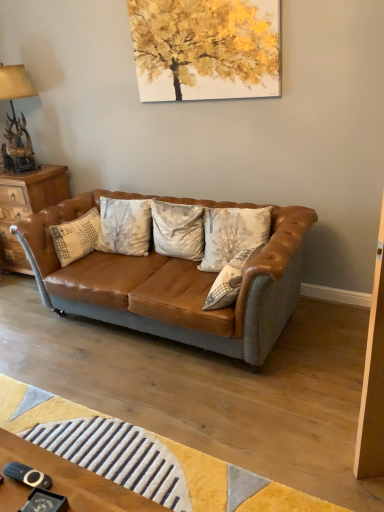
I want to click on white textured pillow at center, the first pillow when ordered from left to right, so click(x=77, y=237).

The width and height of the screenshot is (384, 512). I want to click on yellow woolen mat at lower center, so click(x=143, y=456).

Where is `silky beige pillow at center, the third pillow when ordered from right to left`? The height and width of the screenshot is (512, 384). silky beige pillow at center, the third pillow when ordered from right to left is located at coordinates (178, 230).

Describe the element at coordinates (178, 230) in the screenshot. The image size is (384, 512). I see `silky beige pillow at center, positioned as the 2th pillow in left-to-right order` at that location.

What do you see at coordinates (232, 234) in the screenshot? I see `textured beige pillow at center, marked as the 4th pillow in a left-to-right arrangement` at bounding box center [232, 234].

I want to click on antler bronze lamp at upper left, so click(16, 119).

The width and height of the screenshot is (384, 512). What do you see at coordinates (229, 281) in the screenshot?
I see `textured beige pillow at center, which is counted as the third pillow, starting from the left` at bounding box center [229, 281].

Identify the location of white textured pillow at center, the first pillow when ordered from left to right. (77, 237).

From a real-world perspective, is yellow woolen mat at lower center on top of white textured pillow at center, the first pillow when ordered from left to right?

Incorrect, from a real-world perspective, yellow woolen mat at lower center is lower than white textured pillow at center, the first pillow when ordered from left to right.

Is yellow woolen mat at lower center oriented away from white textured pillow at center, the first pillow when ordered from left to right?

No, yellow woolen mat at lower center is not facing away from white textured pillow at center, the first pillow when ordered from left to right.

In the scene shown: Considering the relative positions of yellow woolen mat at lower center and white textured pillow at center, positioned as the 4th pillow in right-to-left order, in the image provided, is yellow woolen mat at lower center to the left of white textured pillow at center, positioned as the 4th pillow in right-to-left order, from the viewer's perspective?

No, yellow woolen mat at lower center is not to the left of white textured pillow at center, positioned as the 4th pillow in right-to-left order.

Is antler bronze lamp at upper left to the left of yellow woolen mat at lower center from the viewer's perspective?

Indeed, antler bronze lamp at upper left is positioned on the left side of yellow woolen mat at lower center.

Is antler bronze lamp at upper left smaller than yellow woolen mat at lower center?

Actually, antler bronze lamp at upper left might be larger than yellow woolen mat at lower center.

Can you see antler bronze lamp at upper left touching yellow woolen mat at lower center?

No, antler bronze lamp at upper left is not making contact with yellow woolen mat at lower center.

How distant is white textured pillow at center, the first pillow when ordered from left to right, from wooden nightstand at left?

white textured pillow at center, the first pillow when ordered from left to right, and wooden nightstand at left are 25.76 inches apart from each other.

Is white textured pillow at center, positioned as the 4th pillow in right-to-left order, positioned with its back to wooden nightstand at left?

Yes, white textured pillow at center, positioned as the 4th pillow in right-to-left order,'s orientation is away from wooden nightstand at left.

Is point (95, 209) farther from camera compared to point (55, 185)?

No, (95, 209) is closer to viewer.

Looking at this image, from a real-world perspective, who is located lower, white textured pillow at center, positioned as the 4th pillow in right-to-left order, or wooden nightstand at left?

From a 3D spatial view, wooden nightstand at left is below.

Is silky beige pillow at center, positioned as the 2th pillow in left-to-right order, wider or thinner than yellow woolen mat at lower center?

In the image, silky beige pillow at center, positioned as the 2th pillow in left-to-right order, appears to be more narrow than yellow woolen mat at lower center.

Can you confirm if silky beige pillow at center, positioned as the 2th pillow in left-to-right order, is shorter than yellow woolen mat at lower center?

No.

Does point (163, 239) come farther from viewer compared to point (14, 380)?

Yes, point (163, 239) is farther from viewer.

Looking at their sizes, would you say leather couch at center is wider or thinner than antler bronze lamp at upper left?

In the image, leather couch at center appears to be wider than antler bronze lamp at upper left.

You are a GUI agent. You are given a task and a screenshot of the screen. Output one action in this format:
    pyautogui.click(x=<x>, y=<y>)
    Task: Click on the studio couch on the right of antler bronze lamp at upper left
    
    Given the screenshot: What is the action you would take?
    pyautogui.click(x=172, y=284)

Is leather couch at center far away from antler bronze lamp at upper left?

That's right, there is a large distance between leather couch at center and antler bronze lamp at upper left.

Choose the correct answer: Is wooden nightstand at left inside textured beige pillow at center, the first pillow positioned from the right, or outside it?

wooden nightstand at left is outside textured beige pillow at center, the first pillow positioned from the right.

Is wooden nightstand at left with textured beige pillow at center, the first pillow positioned from the right?

wooden nightstand at left and textured beige pillow at center, the first pillow positioned from the right, are not in contact.

Considering the sizes of wooden nightstand at left and textured beige pillow at center, the first pillow positioned from the right, in the image, is wooden nightstand at left taller or shorter than textured beige pillow at center, the first pillow positioned from the right,?

In the image, wooden nightstand at left appears to be taller than textured beige pillow at center, the first pillow positioned from the right.

Is wooden nightstand at left to the left of textured beige pillow at center, the first pillow positioned from the right, from the viewer's perspective?

Indeed, wooden nightstand at left is positioned on the left side of textured beige pillow at center, the first pillow positioned from the right.

Considering the positions of point (202, 262) and point (160, 295), is point (202, 262) closer or farther from the camera than point (160, 295)?

Point (202, 262) is farther from the camera than point (160, 295).

How many degrees apart are the facing directions of textured beige pillow at center, marked as the 4th pillow in a left-to-right arrangement, and leather couch at center?

The angular difference between textured beige pillow at center, marked as the 4th pillow in a left-to-right arrangement, and leather couch at center is 1.27 degrees.

Considering the positions of objects textured beige pillow at center, marked as the 4th pillow in a left-to-right arrangement, and leather couch at center in the image provided, who is more to the right, textured beige pillow at center, marked as the 4th pillow in a left-to-right arrangement, or leather couch at center?

textured beige pillow at center, marked as the 4th pillow in a left-to-right arrangement.

Find the location of `the 3rd pillow above the yellow woolen mat at lower center (from the image's perspective)`. the 3rd pillow above the yellow woolen mat at lower center (from the image's perspective) is located at coordinates (77, 237).

Find the location of a particular element. The image size is (384, 512). mat on the right of the antler bronze lamp at upper left is located at coordinates (143, 456).

Which object lies nearer to the anchor point antler bronze lamp at upper left, yellow woolen mat at lower center or leather couch at center?

leather couch at center lies closer to antler bronze lamp at upper left than the other object.

Estimate the real-world distances between objects in this image. Which object is further from textured beige pillow at center, the first pillow positioned from the right, textured beige pillow at center, the 2th pillow in the right-to-left sequence, or silky beige pillow at center, positioned as the 2th pillow in left-to-right order?

textured beige pillow at center, the 2th pillow in the right-to-left sequence, is positioned further to the anchor textured beige pillow at center, the first pillow positioned from the right.

Estimate the real-world distances between objects in this image. Which object is closer to silky beige pillow at center, the third pillow when ordered from right to left, yellow woolen mat at lower center or antler bronze lamp at upper left?

yellow woolen mat at lower center is positioned closer to the anchor silky beige pillow at center, the third pillow when ordered from right to left.

When comparing their distances from white textured pillow at center, the first pillow when ordered from left to right, does antler bronze lamp at upper left or textured beige pillow at center, which is counted as the third pillow, starting from the left, seem further?

The object further to white textured pillow at center, the first pillow when ordered from left to right, is textured beige pillow at center, which is counted as the third pillow, starting from the left.

Considering their positions, is textured beige pillow at center, marked as the 4th pillow in a left-to-right arrangement, positioned closer to white textured pillow at center, the first pillow when ordered from left to right, than leather couch at center?

leather couch at center.

From the picture: From the image, which object appears to be farther from wooden nightstand at left, white textured pillow at center, the first pillow when ordered from left to right, or yellow woolen mat at lower center?

yellow woolen mat at lower center lies further to wooden nightstand at left than the other object.

Which object lies further to the anchor point yellow woolen mat at lower center, wooden nightstand at left or textured beige pillow at center, the first pillow positioned from the right?

Based on the image, wooden nightstand at left appears to be further to yellow woolen mat at lower center.

From the image, which object appears to be farther from wooden nightstand at left, white textured pillow at center, positioned as the 4th pillow in right-to-left order, or textured beige pillow at center, the 2th pillow in the right-to-left sequence?

Based on the image, textured beige pillow at center, the 2th pillow in the right-to-left sequence, appears to be further to wooden nightstand at left.

Image resolution: width=384 pixels, height=512 pixels. Identify the location of studio couch between antler bronze lamp at upper left and textured beige pillow at center, marked as the 4th pillow in a left-to-right arrangement, from left to right. (172, 284).

This screenshot has height=512, width=384. What are the coordinates of `pillow between white textured pillow at center, the first pillow when ordered from left to right, and textured beige pillow at center, the 2th pillow in the right-to-left sequence, in the horizontal direction` in the screenshot? It's located at (178, 230).

The width and height of the screenshot is (384, 512). Identify the location of studio couch that lies between textured beige pillow at center, the first pillow positioned from the right, and yellow woolen mat at lower center from top to bottom. (172, 284).

Locate an element on the screen. studio couch between wooden nightstand at left and textured beige pillow at center, the 2th pillow in the right-to-left sequence, in the horizontal direction is located at coordinates (172, 284).